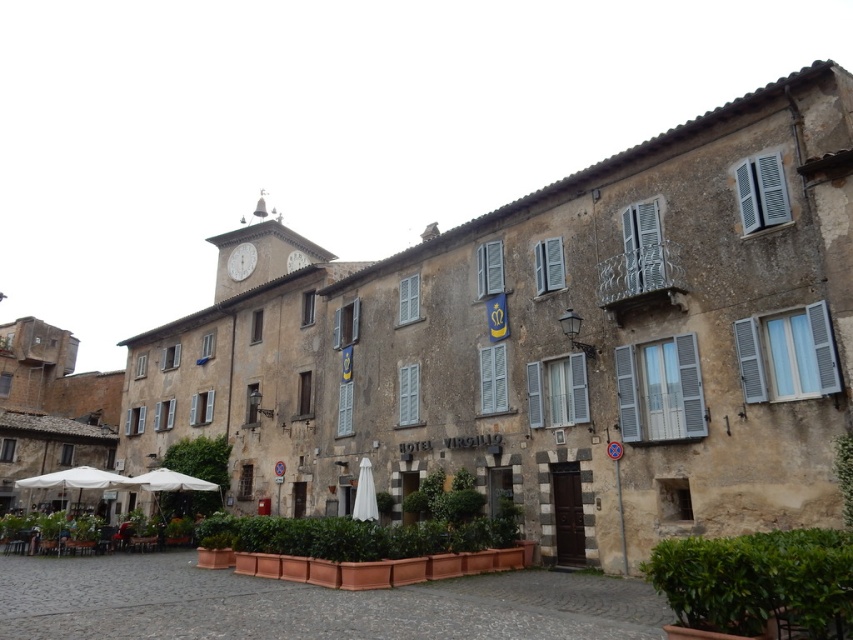
Between white fabric umbrella at center and white stone clock at upper center, which one has more height?

white stone clock at upper center

This screenshot has width=853, height=640. Find the location of `white fabric umbrella at center`. white fabric umbrella at center is located at coordinates (364, 493).